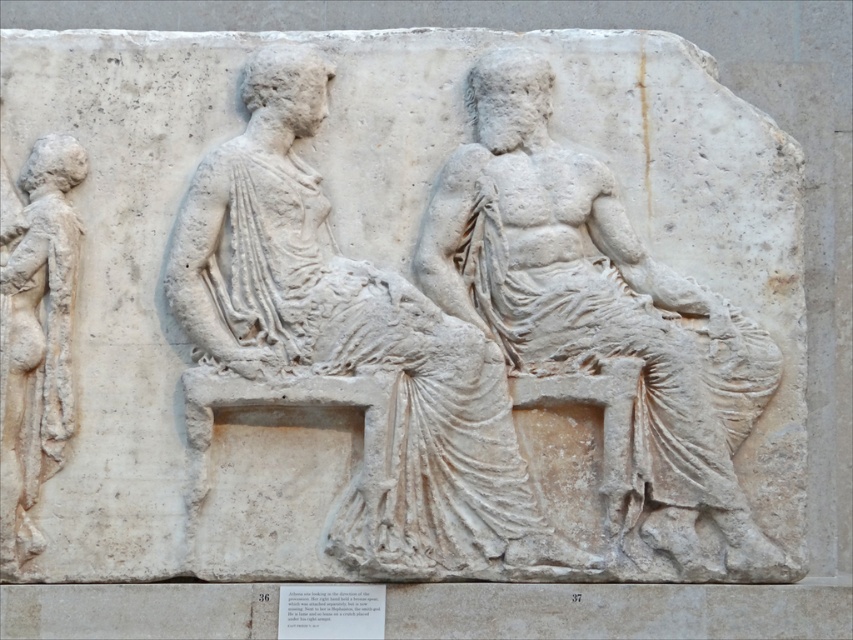
Question: Estimate the real-world distances between objects in this image. Which object is closer to the white marble reclining figure at center?

Choices:
 (A) white marble figure at center
 (B) white marble figure at left

Answer: (A)

Question: Is the position of white marble reclining figure at center more distant than that of white marble figure at center?

Choices:
 (A) no
 (B) yes

Answer: (A)

Question: Is white marble figure at center positioned in front of white marble figure at left?

Choices:
 (A) no
 (B) yes

Answer: (B)

Question: Which object is closer to the camera taking this photo?

Choices:
 (A) white marble reclining figure at center
 (B) white marble figure at center
 (C) white marble figure at left

Answer: (A)

Question: Among these points, which one is farthest from the camera?

Choices:
 (A) (45, 298)
 (B) (410, 372)
 (C) (524, 314)

Answer: (A)

Question: Considering the relative positions of white marble reclining figure at center and white marble figure at center in the image provided, where is white marble reclining figure at center located with respect to white marble figure at center?

Choices:
 (A) right
 (B) left

Answer: (B)